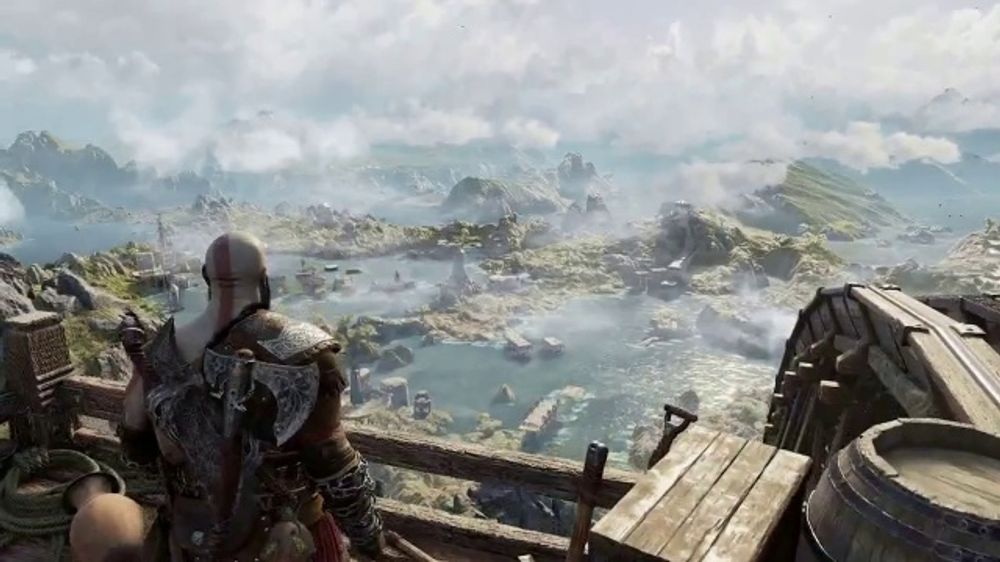
Locate an element on the screen. This screenshot has height=562, width=1000. rim of vase bottom left is located at coordinates (88, 475).